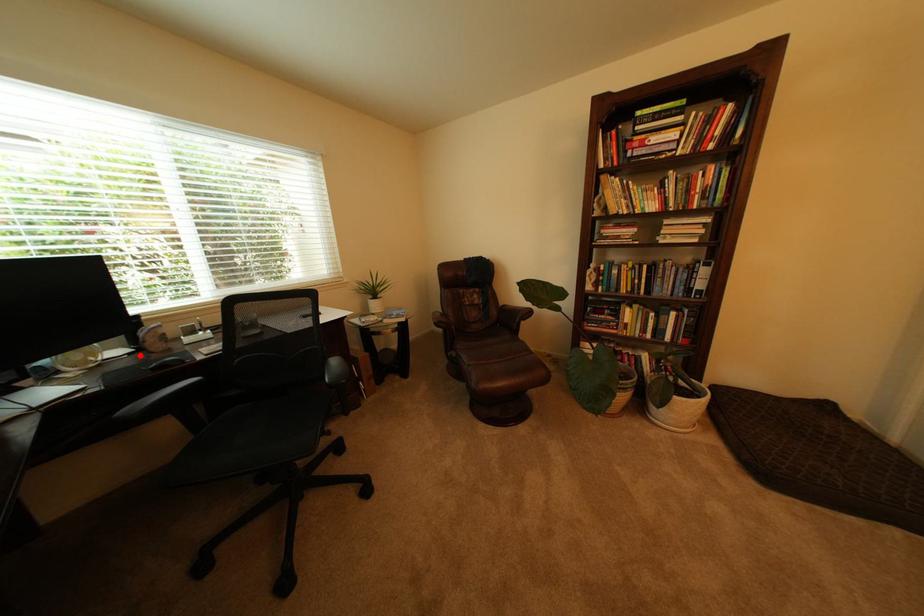
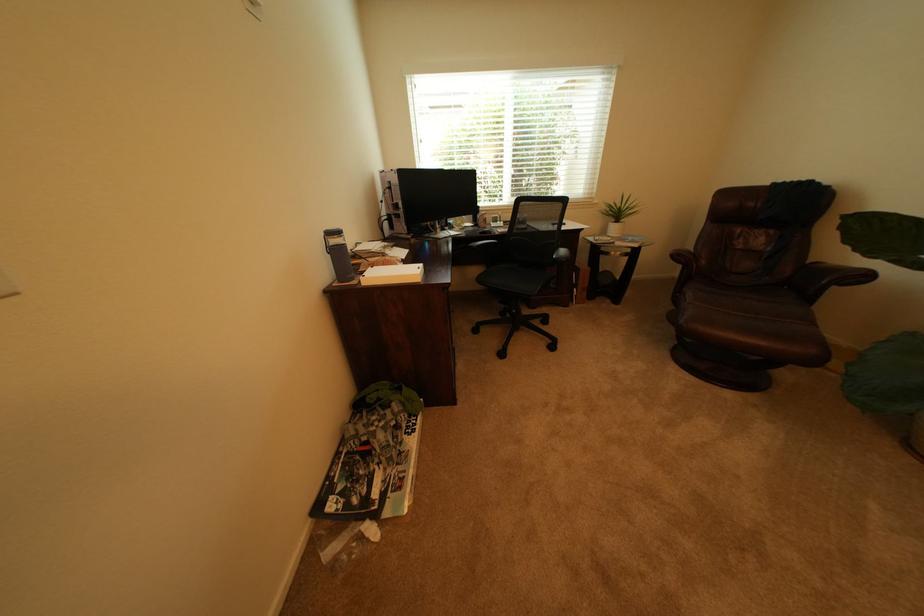
Question: I am providing you with two images of the same scene from different viewpoints. A red point is marked on the first image. At the location where the point appears in image 1, is it still visible in image 2?

Choices:
 (A) Yes
 (B) No

Answer: (A)